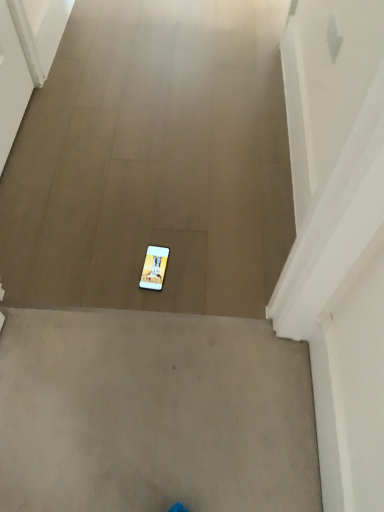
Question: Would you say white glossy mobile phone at center is inside or outside white matte phone at center?

Choices:
 (A) inside
 (B) outside

Answer: (A)

Question: In terms of height, does white glossy mobile phone at center look taller or shorter compared to white matte phone at center?

Choices:
 (A) tall
 (B) short

Answer: (B)

Question: Looking at their shapes, would you say white glossy mobile phone at center is wider or thinner than white matte phone at center?

Choices:
 (A) wide
 (B) thin

Answer: (B)

Question: Is point (274, 134) positioned closer to the camera than point (155, 272)?

Choices:
 (A) closer
 (B) farther

Answer: (B)

Question: From a real-world perspective, is white matte phone at center physically located above or below white glossy mobile phone at center?

Choices:
 (A) below
 (B) above

Answer: (B)

Question: Would you say white matte phone at center is to the left or to the right of white glossy mobile phone at center in the picture?

Choices:
 (A) right
 (B) left

Answer: (B)

Question: Looking at their shapes, would you say white matte phone at center is wider or thinner than white glossy mobile phone at center?

Choices:
 (A) wide
 (B) thin

Answer: (A)